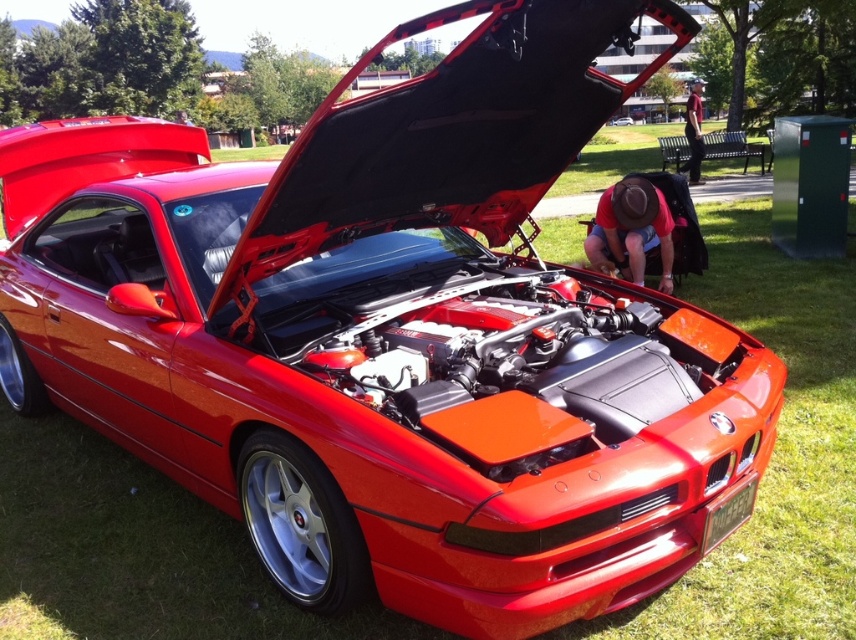
You are standing at the point with coordinates point (691, 179) and want to walk towards the car. Which direction should you move to reach the car first, towards point (669, 230) or away from it?

You should move towards point (669, 230) because it is in front of point (691, 179), meaning it is closer to the car.

You are a photographer trying to capture both the red cotton shirt at center and the maroon fabric shirt at upper right in a single frame. Since you want to ensure both are visible, which shirt should you focus on adjusting the camera angle for to include both?

The red cotton shirt at center has a lesser height compared to maroon fabric shirt at upper right. To include both in the frame, adjust the camera angle to account for the taller maroon fabric shirt at upper right, ensuring the shorter red cotton shirt at center remains visible.

You are a photographer taking a picture of the red BMW sports car parked on the grassy area. You want to ensure the red cotton shirt at center is visible in the frame. Where should you position yourself to include both the car and the shirt in the photo?

Position yourself so that your camera is aimed towards the red BMW sports car parked on the grassy area while ensuring the red cotton shirt at center is within the frame at point coordinates approximately 0.361 on the x axis and 0.738 on the y axis.